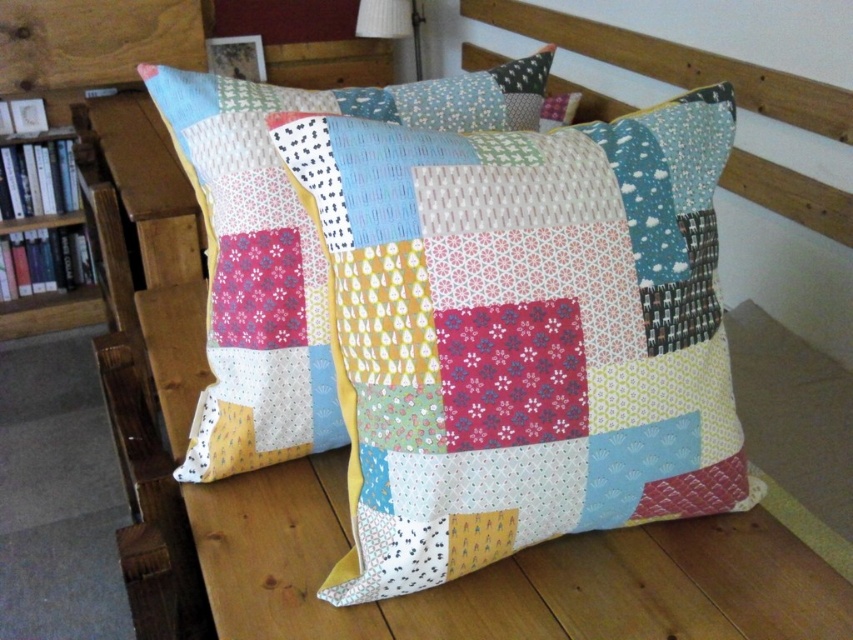
You are organizing a small party and need to know if the patchwork fabric pillow at center can fit on a shelf that can hold items up to the size of the wooden bookcase at left. Can it fit?

The patchwork fabric pillow at center has a smaller size compared to the wooden bookcase at left, so it can fit on the shelf designed for items up to the size of the wooden bookcase at left.

What are the coordinates of the patchwork fabric pillow at center?

The coordinates of the patchwork fabric pillow at center are at point (521, 332).